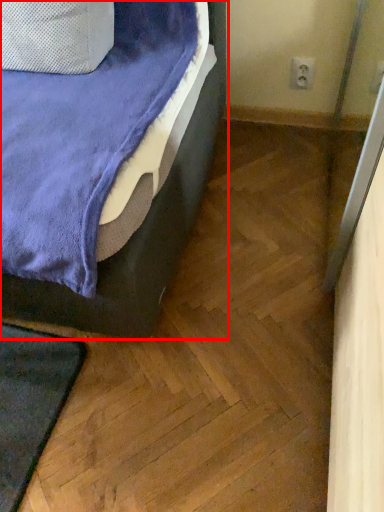
Question: Observing the image, what is the correct spatial positioning of bed (annotated by the red box) in reference to electric outlet?

Choices:
 (A) left
 (B) right

Answer: (A)